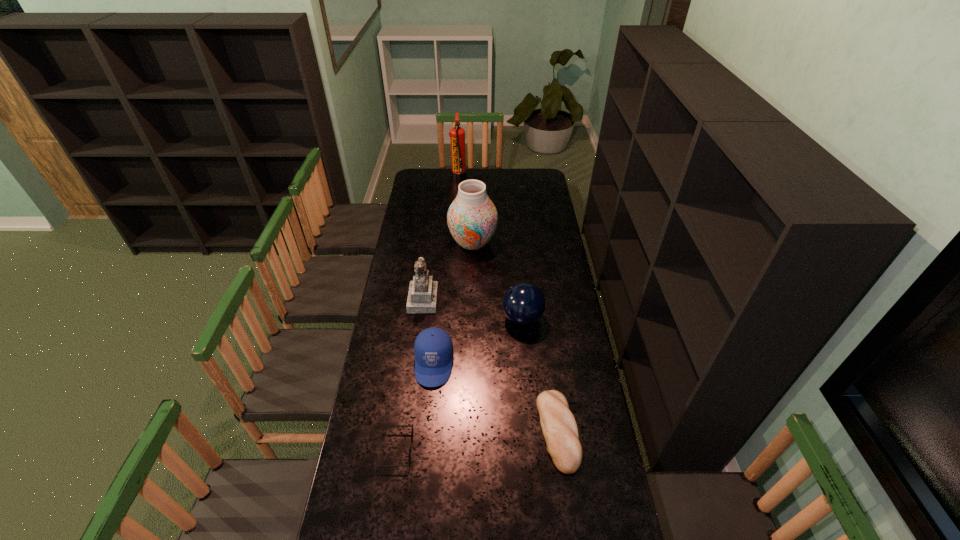
Find the location of `vacant space located 0.260m on the front-facing side of the third tallest object`. vacant space located 0.260m on the front-facing side of the third tallest object is located at coordinates (494, 299).

Locate an element on the screen. free space located 0.210m on the surface of the fourth shortest object near the finger holes is located at coordinates (454, 318).

This screenshot has width=960, height=540. I want to click on free space located on the surface of the fourth shortest object near the finger holes, so 489,318.

At what (x,y) coordinates should I click in order to perform the action: click on free spot located 0.090m on the surface of the fourth shortest object near the finger holes. Please return your answer as a coordinate pair (x, y). Looking at the image, I should click on (481, 318).

Find the location of a particular element. vacant space situated on the front-facing side of the cap is located at coordinates (429, 421).

I want to click on vacant space positioned 0.140m on the front of the bread, so click(x=570, y=522).

This screenshot has width=960, height=540. In order to click on vacant space situated 0.120m on the front-facing side of the shortest object in this screenshot , I will do `click(447, 449)`.

This screenshot has width=960, height=540. I want to click on object that is at the far edge, so click(x=457, y=134).

The width and height of the screenshot is (960, 540). I want to click on figurine that is at the left edge, so click(422, 297).

What are the coordinates of `sunglasses positioned at the left edge` in the screenshot? It's located at (393, 425).